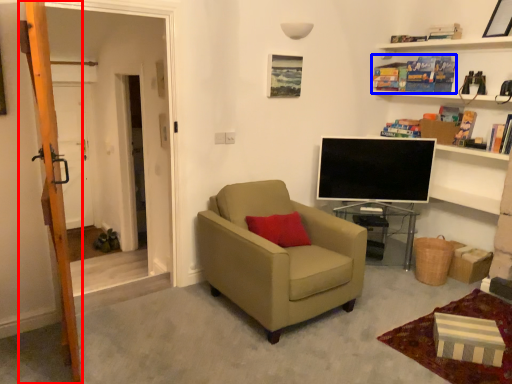
Question: Which object appears farthest to the camera in this image, ladder (highlighted by a red box) or book (highlighted by a blue box)?

Choices:
 (A) ladder
 (B) book

Answer: (B)